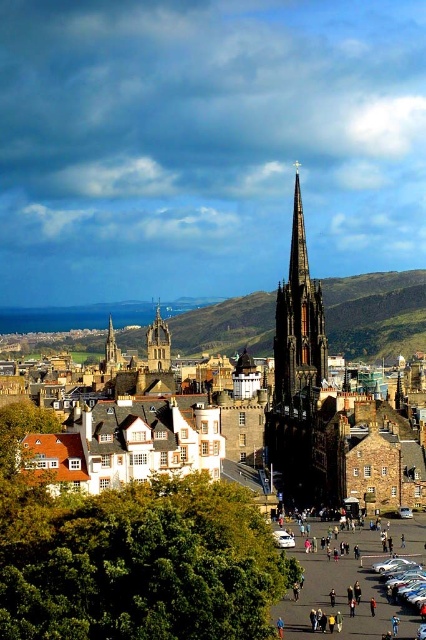
Question: Is dark brown stone spire at center above golden stone spire at center?

Choices:
 (A) yes
 (B) no

Answer: (A)

Question: Can you confirm if dark brown stone spire at center is bigger than golden stone spire at center?

Choices:
 (A) no
 (B) yes

Answer: (B)

Question: Which point is farther to the camera?

Choices:
 (A) (301, 422)
 (B) (161, 362)

Answer: (B)

Question: Among these points, which one is nearest to the camera?

Choices:
 (A) click(x=157, y=330)
 (B) click(x=302, y=356)

Answer: (B)

Question: Does dark brown stone spire at center appear on the right side of golden stone spire at center?

Choices:
 (A) no
 (B) yes

Answer: (B)